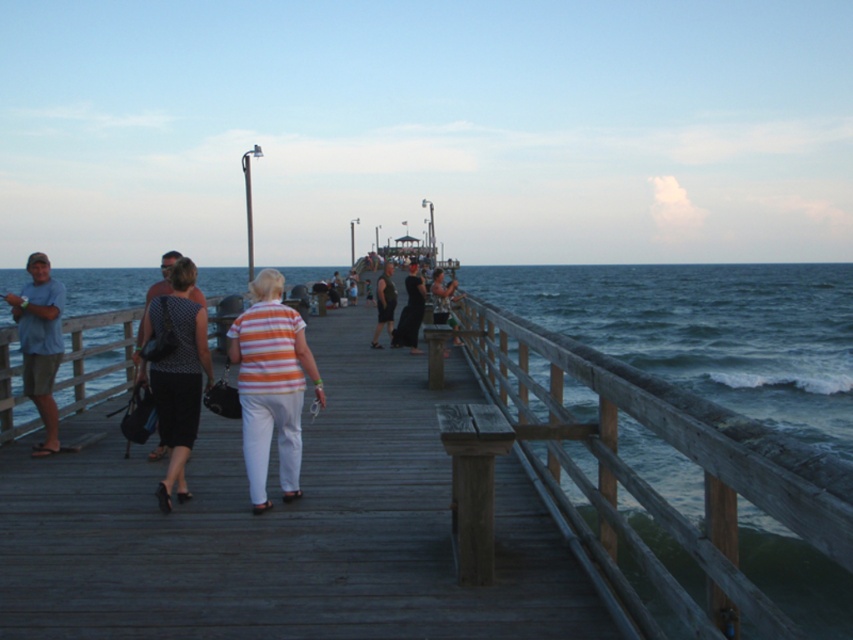
You are standing on the wooden dock at center and want to place a small picnic basket next to the black dress at center. Can you fit the basket there without moving the dress?

The wooden dock at center is larger in size than the black dress at center, so there should be enough space to place the picnic basket next to the dress without moving it.

You are standing on the wooden dock at center and want to see the matte black dress at center. Is the dress visible from your current position?

The wooden dock at center is above matte black dress at center, so the dress is not visible from your current position on the dock.

You are a photographer trying to capture a wide shot of the wooden dock at center and the dark gray fabric shirt at center. Since you want both subjects to be clearly visible in the frame, which object should you focus on first to ensure proper depth of field?

The wooden dock at center has a larger size compared to dark gray fabric shirt at center, so you should focus on the wooden dock at center first to ensure both are in focus.